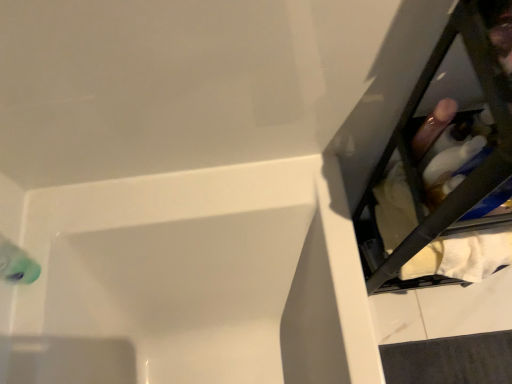
In order to face white glossy bathtub at lower left, should I rotate leftwards or rightwards?

Rotate left and turn 6.059 degrees.

Describe the element at coordinates (196, 279) in the screenshot. This screenshot has height=384, width=512. I see `white glossy bathtub at lower left` at that location.

Locate an element on the screen. Image resolution: width=512 pixels, height=384 pixels. white glossy bathtub at lower left is located at coordinates (196, 279).

Measure the distance between white fabric at right and camera.

white fabric at right is 18.53 inches from camera.

Looking at this image, in order to face white fabric at right, should I rotate leftwards or rightwards?

Rotate right and turn 26.773 degrees.

Describe the element at coordinates (423, 160) in the screenshot. I see `white fabric at right` at that location.

Find the location of a particular element. The image size is (512, 384). white fabric at right is located at coordinates (423, 160).

Looking at this image, measure the distance between point (465, 183) and camera.

A distance of 21.69 inches exists between point (465, 183) and camera.

I want to click on white glossy bathtub at lower left, so 196,279.

Is white fabric at right to the right of white glossy bathtub at lower left from the viewer's perspective?

Yes, white fabric at right is to the right of white glossy bathtub at lower left.

Which is in front, white fabric at right or white glossy bathtub at lower left?

Positioned in front is white fabric at right.

Which is behind, point (423, 284) or point (326, 271)?

The point (423, 284) is behind.

From the image's perspective, between white fabric at right and white glossy bathtub at lower left, who is located below?

From the image's view, white glossy bathtub at lower left is below.

From a real-world perspective, relative to white glossy bathtub at lower left, is white fabric at right vertically above or below?

In terms of real-world spatial position, white fabric at right is above white glossy bathtub at lower left.

Does white fabric at right have a lesser width compared to white glossy bathtub at lower left?

Yes.

Between white fabric at right and white glossy bathtub at lower left, which one has less height?

Standing shorter between the two is white glossy bathtub at lower left.

Considering the sizes of objects white fabric at right and white glossy bathtub at lower left in the image provided, who is smaller, white fabric at right or white glossy bathtub at lower left?

white fabric at right is smaller.

Would you say white fabric at right is outside white glossy bathtub at lower left?

Yes, white fabric at right is not within white glossy bathtub at lower left.

Is white fabric at right positioned far away from white glossy bathtub at lower left?

That's not correct — white fabric at right is a little close to white glossy bathtub at lower left.

Does white fabric at right turn towards white glossy bathtub at lower left?

No.

How different are the orientations of white fabric at right and white glossy bathtub at lower left in degrees?

They differ by 88.4 degrees in their facing directions.

Measure the distance between white fabric at right and white glossy bathtub at lower left.

15.59 inches.

This screenshot has height=384, width=512. Identify the location of bathtub below the white fabric at right (from a real-world perspective). (196, 279).

Considering the positions of objects white glossy bathtub at lower left and white fabric at right in the image provided, who is more to the right, white glossy bathtub at lower left or white fabric at right?

From the viewer's perspective, white fabric at right appears more on the right side.

Considering the relative positions of white glossy bathtub at lower left and white fabric at right in the image provided, is white glossy bathtub at lower left behind white fabric at right?

Yes, white glossy bathtub at lower left is further from the camera.

Which is more distant, (210, 338) or (476, 63)?

The point (210, 338) is farther from the camera.

From the image's perspective, is white glossy bathtub at lower left on white fabric at right?

No, from the image's perspective, white glossy bathtub at lower left is not over white fabric at right.

From a real-world perspective, is white glossy bathtub at lower left below white fabric at right?

Yes, from a real-world perspective, white glossy bathtub at lower left is under white fabric at right.

Considering the sizes of objects white glossy bathtub at lower left and white fabric at right in the image provided, who is wider, white glossy bathtub at lower left or white fabric at right?

white glossy bathtub at lower left is wider.

Does white glossy bathtub at lower left have a lesser height compared to white fabric at right?

Yes.

Considering the relative sizes of white glossy bathtub at lower left and white fabric at right in the image provided, is white glossy bathtub at lower left smaller than white fabric at right?

Incorrect, white glossy bathtub at lower left is not smaller in size than white fabric at right.

In the scene shown: Is white glossy bathtub at lower left not within white fabric at right?

Yes, white glossy bathtub at lower left is located beyond the bounds of white fabric at right.

Is white glossy bathtub at lower left directly adjacent to white fabric at right?

They are not placed beside each other.

Is white glossy bathtub at lower left facing away from white fabric at right?

No, white glossy bathtub at lower left is not facing the opposite direction of white fabric at right.

Where is `bathtub that appears on the left of white fabric at right`? The width and height of the screenshot is (512, 384). bathtub that appears on the left of white fabric at right is located at coordinates (196, 279).

Find the location of a particular element. bathtub on the left side of white fabric at right is located at coordinates [x=196, y=279].

This screenshot has height=384, width=512. In order to click on furniture that appears on the right of white glossy bathtub at lower left in this screenshot , I will do `click(423, 160)`.